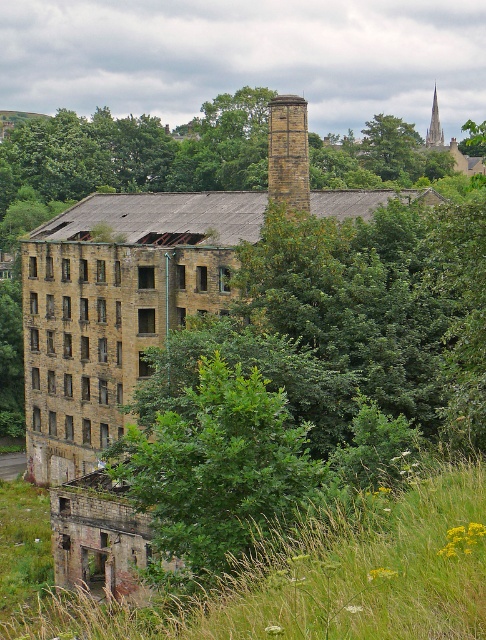
You are an architect assessing the site for potential renovation. You notice the green leafy tree at center and the smooth stone spire at upper right. Which object takes up more space in the image?

The smooth stone spire at upper right takes up more space in the image than the green leafy tree at center, as the tree occupies less space according to the description.

You are a painter planning to sketch the industrial building. You want to ensure your drawing accurately represents the relative widths of the brown brick chimney at center and the smooth stone spire at upper right. Which object should you draw wider in your sketch?

The smooth stone spire at upper right should be drawn wider than the brown brick chimney at center because the brown brick chimney at center has a smaller width according to the description.

You are an architect visiting the ruins and want to determine which structure is taller between the green leafy tree at center and the smooth stone spire at upper right. Based on the scene, which one is taller?

The smooth stone spire at upper right is taller than the green leafy tree at center.